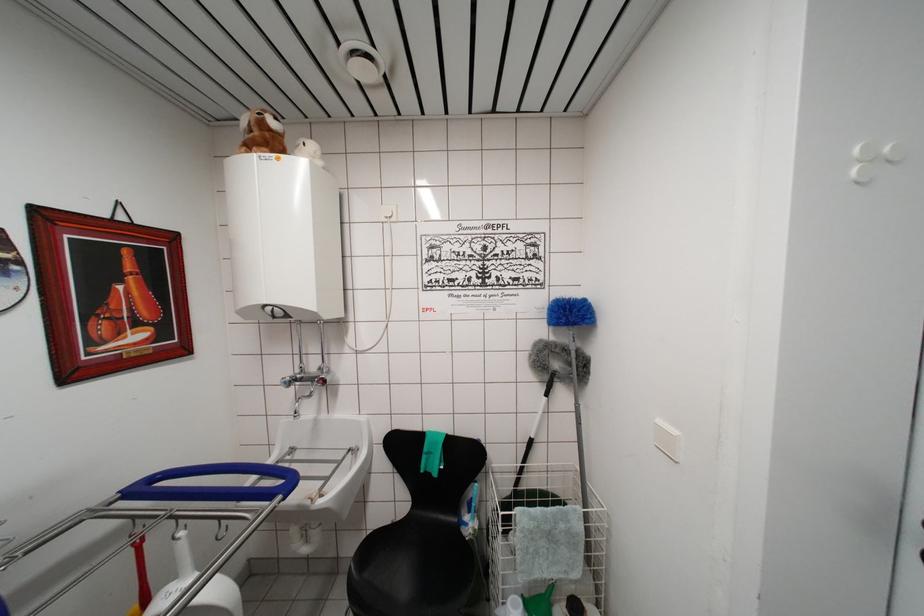
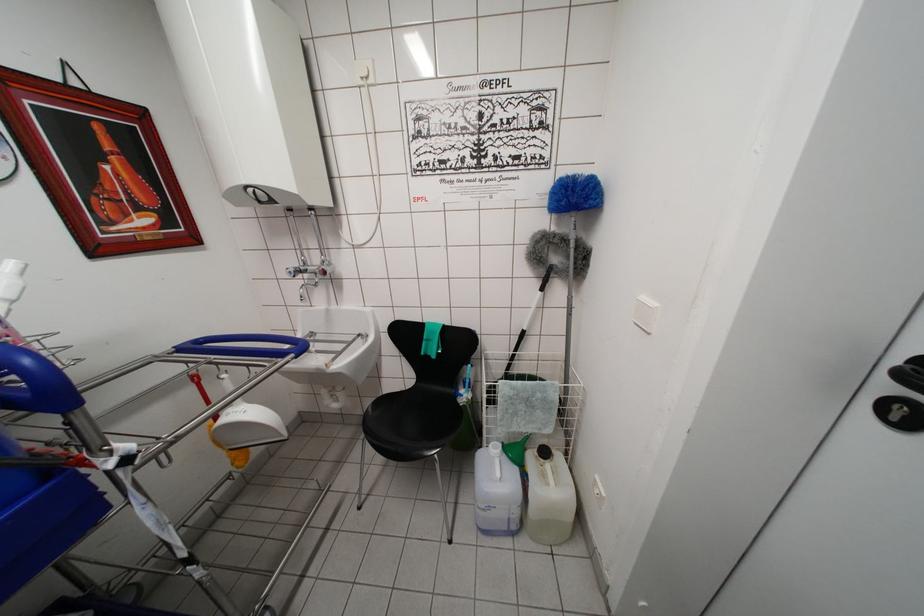
Locate, in the second image, the point that corresponds to the point at 325,487 in the first image.

(338, 360)